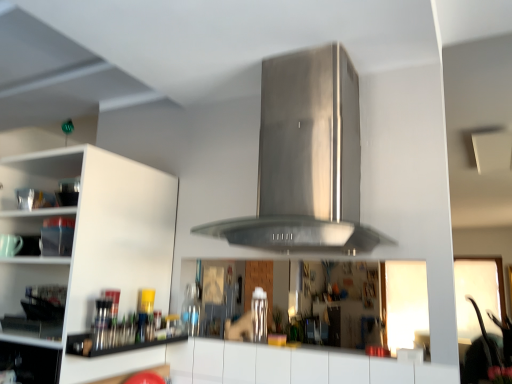
Describe the element at coordinates (306, 160) in the screenshot. This screenshot has height=384, width=512. I see `stainless steel vent at center` at that location.

At what (x,y) coordinates should I click in order to perform the action: click on stainless steel vent at center. Please return your answer as a coordinate pair (x, y). This screenshot has width=512, height=384. Looking at the image, I should click on (306, 160).

Is metallic silver utensils at lower left turned away from stainless steel vent at center?

No, metallic silver utensils at lower left's orientation is not away from stainless steel vent at center.

Does metallic silver utensils at lower left have a greater height compared to stainless steel vent at center?

In fact, metallic silver utensils at lower left may be shorter than stainless steel vent at center.

Would you say metallic silver utensils at lower left is outside stainless steel vent at center?

metallic silver utensils at lower left lies outside stainless steel vent at center's area.

How different are the orientations of metallic silver utensils at lower left and stainless steel vent at center in degrees?

The facing directions of metallic silver utensils at lower left and stainless steel vent at center are 90.4 degrees apart.

Which is less distant, (289, 76) or (76, 345)?

Point (289, 76) is positioned farther from the camera compared to point (76, 345).

Is metallic silver utensils at lower left surrounded by stainless steel vent at center?

No, metallic silver utensils at lower left is not inside stainless steel vent at center.

Measure the distance between stainless steel vent at center and metallic silver utensils at lower left.

The distance of stainless steel vent at center from metallic silver utensils at lower left is 36.33 inches.

Which object is positioned more to the right, metallic silver utensils at lower left or white matte cabinet at left?

From the viewer's perspective, metallic silver utensils at lower left appears more on the right side.

Does metallic silver utensils at lower left come in front of white matte cabinet at left?

No, metallic silver utensils at lower left is further to the viewer.

Image resolution: width=512 pixels, height=384 pixels. In order to click on shelf lying behind the white matte cabinet at left in this screenshot , I will do `click(111, 343)`.

Who is taller, metallic silver utensils at lower left or white matte cabinet at left?

white matte cabinet at left is taller.

Which object is thinner, white matte cabinet at left or metallic silver utensils at lower left?

metallic silver utensils at lower left.

From the image's perspective, which is below, white matte cabinet at left or metallic silver utensils at lower left?

metallic silver utensils at lower left appears lower in the image.

Considering the sizes of objects white matte cabinet at left and metallic silver utensils at lower left in the image provided, who is taller, white matte cabinet at left or metallic silver utensils at lower left?

Standing taller between the two is white matte cabinet at left.

Is white matte cabinet at left positioned beyond the bounds of metallic silver utensils at lower left?

Yes, white matte cabinet at left is outside of metallic silver utensils at lower left.

Considering the sizes of white matte cabinet at left and stainless steel vent at center in the image, is white matte cabinet at left bigger or smaller than stainless steel vent at center?

Considering their sizes, white matte cabinet at left takes up more space than stainless steel vent at center.

How different are the orientations of white matte cabinet at left and stainless steel vent at center in degrees?

There is a 0.216-degree angle between the facing directions of white matte cabinet at left and stainless steel vent at center.

Is point (83, 169) behind point (287, 218)?

Yes.

Is white matte cabinet at left facing away from stainless steel vent at center?

No, stainless steel vent at center is not at the back of white matte cabinet at left.

Is stainless steel vent at center turned away from white matte cabinet at left?

No, stainless steel vent at center is not facing away from white matte cabinet at left.

In the scene shown: Is stainless steel vent at center touching white matte cabinet at left?

No, stainless steel vent at center is not next to white matte cabinet at left.

From the image's perspective, which is above, stainless steel vent at center or white matte cabinet at left?

stainless steel vent at center.

The height and width of the screenshot is (384, 512). Identify the location of shelf on the left of stainless steel vent at center. (111, 343).

There is a metallic silver utensils at lower left. Identify the location of vent above it (from a real-world perspective). The width and height of the screenshot is (512, 384). (306, 160).

Considering their positions, is stainless steel vent at center positioned further to metallic silver utensils at lower left than white matte cabinet at left?

stainless steel vent at center is further to metallic silver utensils at lower left.

Based on their spatial positions, is stainless steel vent at center or metallic silver utensils at lower left further from white matte cabinet at left?

Based on the image, stainless steel vent at center appears to be further to white matte cabinet at left.

Which object lies further to the anchor point stainless steel vent at center, metallic silver utensils at lower left or white matte cabinet at left?

The object further to stainless steel vent at center is metallic silver utensils at lower left.

Estimate the real-world distances between objects in this image. Which object is further from stainless steel vent at center, white matte cabinet at left or metallic silver utensils at lower left?

The object further to stainless steel vent at center is metallic silver utensils at lower left.

From the image, which object appears to be nearer to white matte cabinet at left, metallic silver utensils at lower left or stainless steel vent at center?

The object closer to white matte cabinet at left is metallic silver utensils at lower left.

Looking at the image, which one is located further to metallic silver utensils at lower left, white matte cabinet at left or stainless steel vent at center?

stainless steel vent at center.

The height and width of the screenshot is (384, 512). Find the location of `shelf between white matte cabinet at left and stainless steel vent at center from left to right`. shelf between white matte cabinet at left and stainless steel vent at center from left to right is located at coordinates (111, 343).